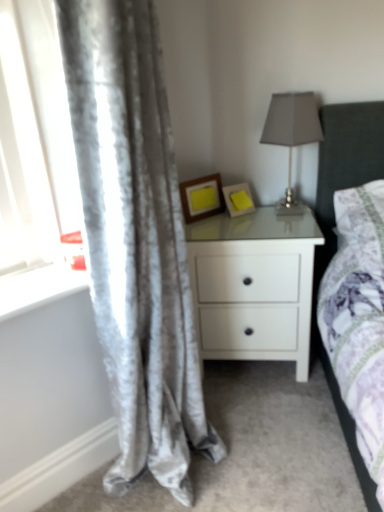
Find the location of a particular element. The height and width of the screenshot is (512, 384). vacant space to the right of yellow matte picture frame at upper center, placed as the second picture frame when sorted from left to right is located at coordinates (275, 212).